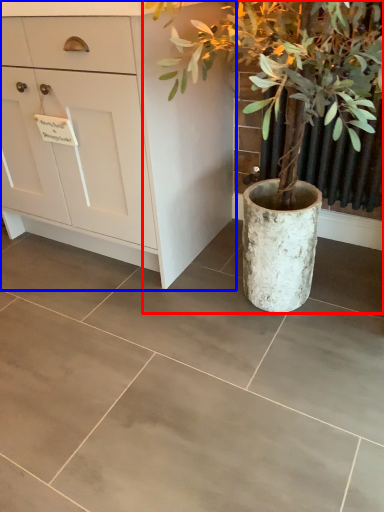
Question: Which object appears farthest to the camera in this image, houseplant (highlighted by a red box) or chest of drawers (highlighted by a blue box)?

Choices:
 (A) houseplant
 (B) chest of drawers

Answer: (B)